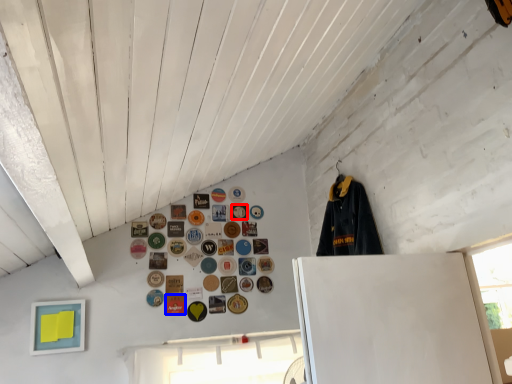
Question: Which of the following is the farthest to the observer, button (highlighted by a red box) or button (highlighted by a blue box)?

Choices:
 (A) button
 (B) button

Answer: (A)